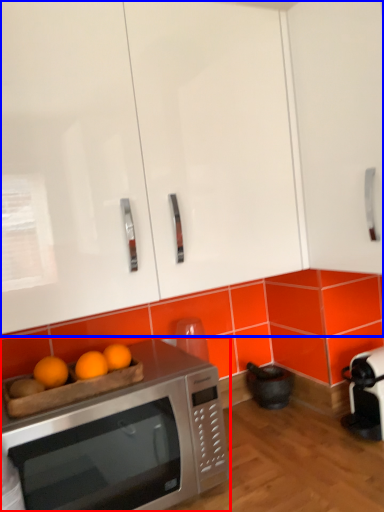
Question: Which of the following is the closest to the observer, microwave oven (highlighted by a red box) or cabinetry (highlighted by a blue box)?

Choices:
 (A) microwave oven
 (B) cabinetry

Answer: (B)